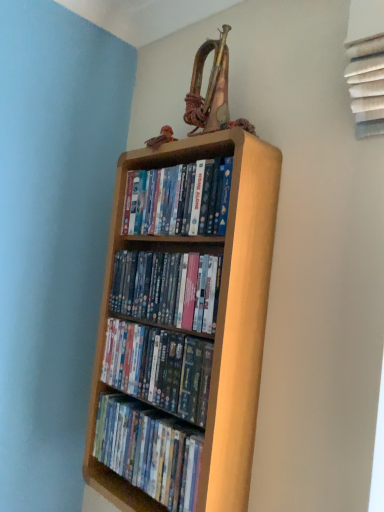
Question: Which direction should I rotate to look at wooden shelf at center, the first book when ordered from bottom to top, — up or down?

Choices:
 (A) down
 (B) up

Answer: (A)

Question: From a real-world perspective, does wooden shelf at center, the 3th book positioned from the bottom, stand above wooden shelf at center, the first book when ordered from bottom to top?

Choices:
 (A) no
 (B) yes

Answer: (B)

Question: From the image's perspective, is wooden shelf at center, the 3th book positioned from the bottom, above wooden shelf at center, the first book when ordered from bottom to top?

Choices:
 (A) no
 (B) yes

Answer: (B)

Question: Is wooden shelf at center, arranged as the second book when viewed from the top, in front of wooden shelf at center, the first book when ordered from bottom to top?

Choices:
 (A) no
 (B) yes

Answer: (A)

Question: Is wooden shelf at center, the 3th book positioned from the bottom, behind wooden shelf at center, the first book when ordered from bottom to top?

Choices:
 (A) no
 (B) yes

Answer: (B)

Question: Does wooden shelf at center, arranged as the second book when viewed from the top, appear on the left side of wooden shelf at center, the first book when ordered from bottom to top?

Choices:
 (A) yes
 (B) no

Answer: (B)

Question: Is wooden shelf at center, arranged as the second book when viewed from the top, oriented towards wooden shelf at center, the 4th book in the top-to-bottom sequence?

Choices:
 (A) yes
 (B) no

Answer: (B)

Question: Considering the relative positions of matte plastic dvds at center, acting as the second book starting from the bottom, and matte wooden shelf at upper center, the first book viewed from the top, in the image provided, is matte plastic dvds at center, acting as the second book starting from the bottom, to the right of matte wooden shelf at upper center, the first book viewed from the top, from the viewer's perspective?

Choices:
 (A) yes
 (B) no

Answer: (B)

Question: Is matte wooden shelf at upper center, the first book viewed from the top, inside matte plastic dvds at center, acting as the second book starting from the bottom?

Choices:
 (A) no
 (B) yes

Answer: (A)

Question: Does matte plastic dvds at center, acting as the second book starting from the bottom, have a greater width compared to matte wooden shelf at upper center, the first book viewed from the top?

Choices:
 (A) yes
 (B) no

Answer: (A)

Question: Does matte plastic dvds at center, acting as the second book starting from the bottom, have a lesser height compared to matte wooden shelf at upper center, the first book viewed from the top?

Choices:
 (A) yes
 (B) no

Answer: (A)

Question: Does matte plastic dvds at center, acting as the second book starting from the bottom, have a lesser width compared to matte wooden shelf at upper center, acting as the fourth book starting from the bottom?

Choices:
 (A) no
 (B) yes

Answer: (A)

Question: From the image's perspective, is matte plastic dvds at center, acting as the second book starting from the bottom, located beneath matte wooden shelf at upper center, acting as the fourth book starting from the bottom?

Choices:
 (A) no
 (B) yes

Answer: (B)

Question: Are light wood bookcase at center and matte plastic dvds at center, acting as the second book starting from the bottom, located far from each other?

Choices:
 (A) no
 (B) yes

Answer: (A)